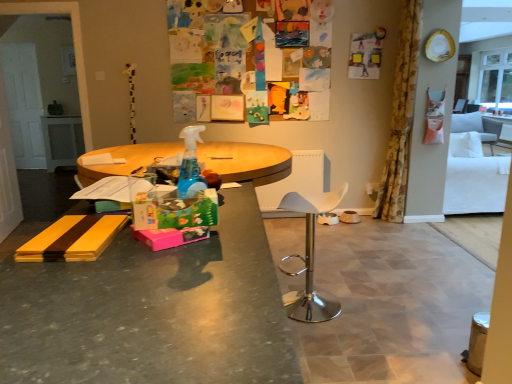
This screenshot has height=384, width=512. I want to click on free area below white plastic chair at center (from a real-world perspective), so click(x=313, y=307).